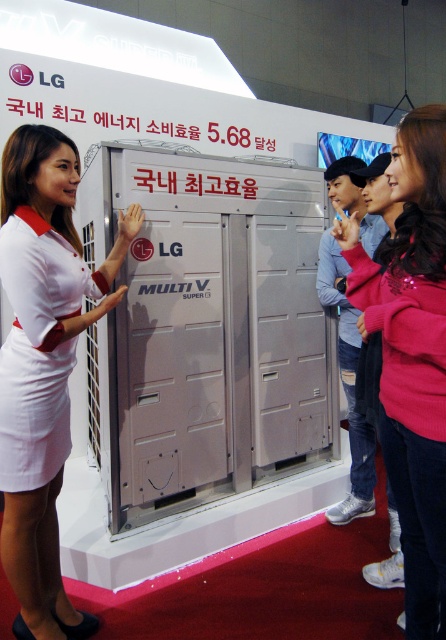
You are standing in front of the LG Multi V Super air conditioning unit at the exhibition. There are two points marked on the display. Which point is closer to you, point at coordinates (x=188, y=288) or point at coordinates (x=50, y=298)?

Point at coordinates (x=188, y=288) is further to the viewer than point at coordinates (x=50, y=298). Therefore, the point at coordinates (x=50, y=298) is closer to you.

You are a photographer at the exhibition. You need to capture a photo of the silver metallic locker at center and the pink sequined sweater at center. Which one is positioned higher in the image?

The silver metallic locker at center is located above the pink sequined sweater at center, so it is positioned higher in the image.

You are standing at the point labeled point (392, 195) in the exhibition hall. You want to move to the point labeled point (252, 412). Is there a clear path between these two points?

Point (252, 412) is behind point (392, 195), so there is no clear path between them.